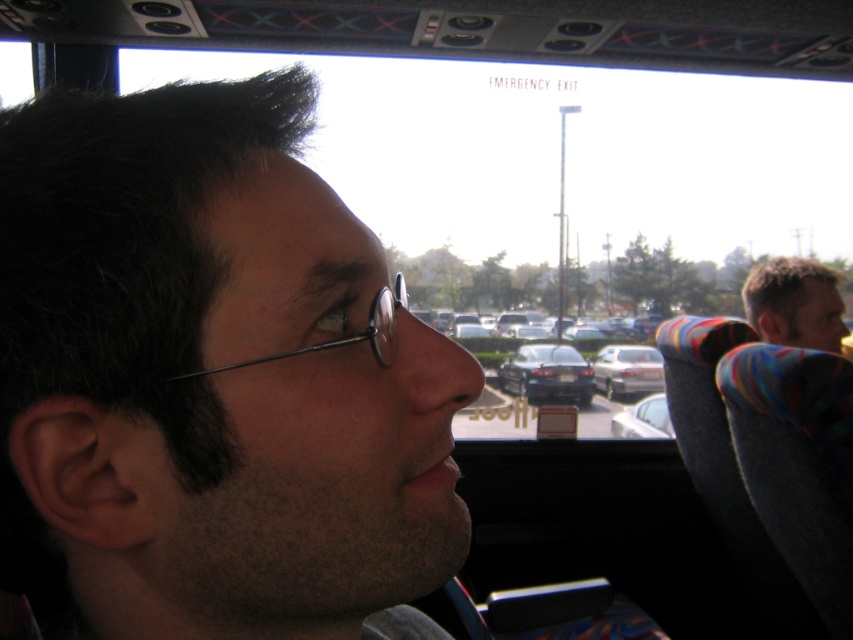
You are a delivery driver who needs to park your van between the matte black car at center and the white glossy car at center. The van is 5 meters long. Is there enough space between them to park your van?

The distance between the matte black car at center and white glossy car at center is 5.32 meters, which is just enough to accommodate the van that is 5 meters long, so yes, there is sufficient space.

You are a delivery driver who needs to load a tall package into the trunk of a car. You have two options in the parking lot view from the bus window. Which car, the matte black car at center or the satin silver sedan at center, would allow the tall package to fit better in its trunk?

The matte black car at center has a greater height compared to the satin silver sedan at center, so the tall package would fit better in its trunk.